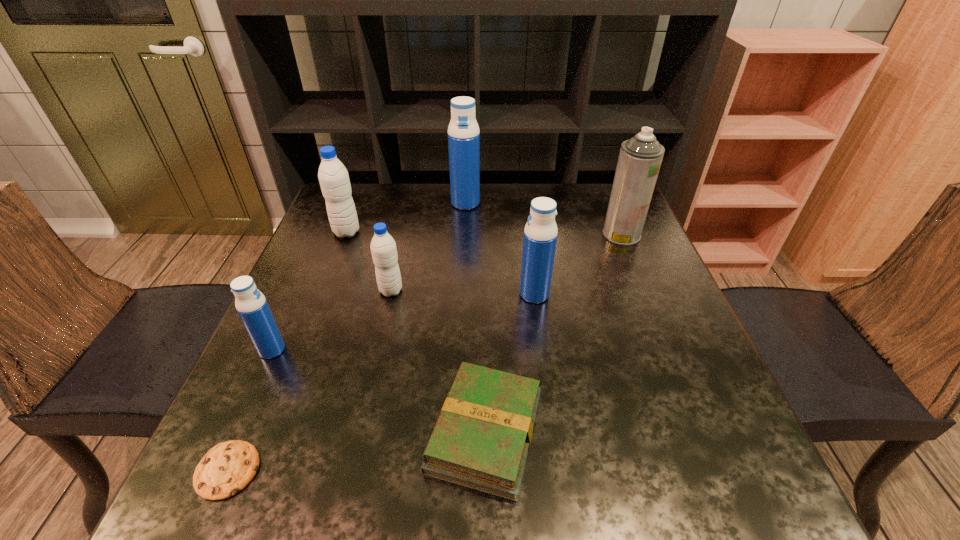
Select which blue water bottle appears as the third closest to the third water bottle from right to left. Please provide its 2D coordinates. Your answer should be formatted as a tuple, i.e. [(x, y)], where the tuple contains the x and y coordinates of a point satisfying the conditions above.

[(463, 131)]

The image size is (960, 540). I want to click on vacant area that satisfies the following two spatial constraints: 1. on the front side of the rightmost object; 2. on the right side of the bigger gray water bottle, so click(346, 234).

The height and width of the screenshot is (540, 960). I want to click on free location that satisfies the following two spatial constraints: 1. on the back side of the nearest blue water bottle; 2. on the right side of the rightmost blue water bottle, so pyautogui.click(x=298, y=294).